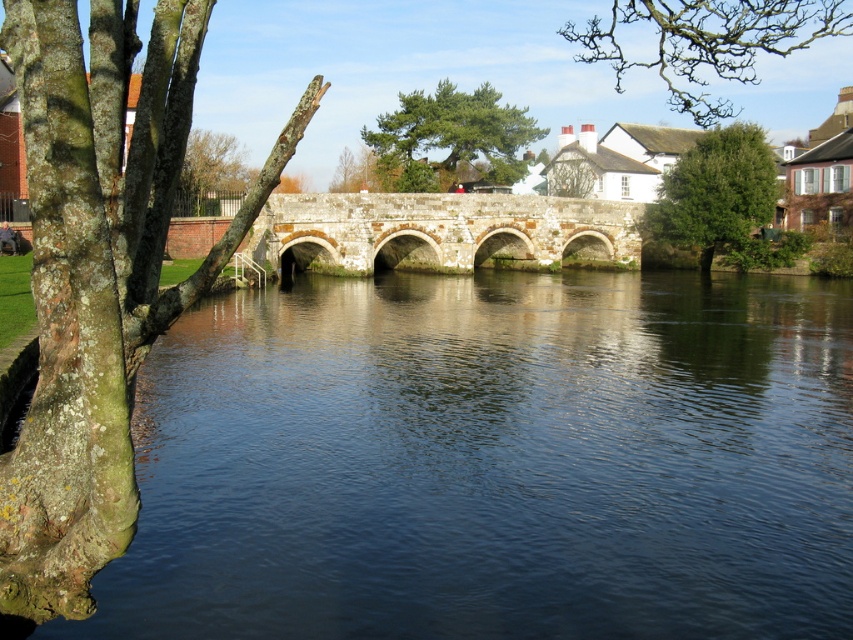
Is bare branches at upper center smaller than green leafy tree at upper left?

No, bare branches at upper center is not smaller than green leafy tree at upper left.

Which of these two, bare branches at upper center or green leafy tree at upper left, stands shorter?

green leafy tree at upper left is shorter.

Who is more forward, (x=697, y=120) or (x=201, y=166)?

Point (x=201, y=166) is more forward.

Identify the location of bare branches at upper center. (703, 42).

Is dark blue water at center wider than stone arch bridge at center?

Indeed, dark blue water at center has a greater width compared to stone arch bridge at center.

Does dark blue water at center have a larger size compared to stone arch bridge at center?

Correct, dark blue water at center is larger in size than stone arch bridge at center.

Identify the location of dark blue water at center. Image resolution: width=853 pixels, height=640 pixels. (492, 461).

Who is positioned more to the right, green lichen-covered tree trunk at left or green textured pine tree at center?

Positioned to the right is green textured pine tree at center.

Is point (126, 289) behind point (361, 132)?

No.

Where is `green lichen-covered tree trunk at left`? The width and height of the screenshot is (853, 640). green lichen-covered tree trunk at left is located at coordinates 99,276.